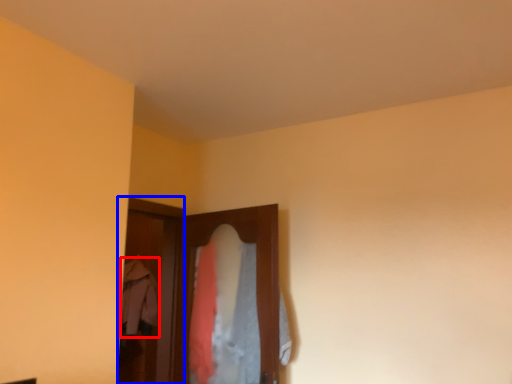
Question: Which object appears farthest to the camera in this image, clothing (highlighted by a red box) or screen door (highlighted by a blue box)?

Choices:
 (A) clothing
 (B) screen door

Answer: (A)